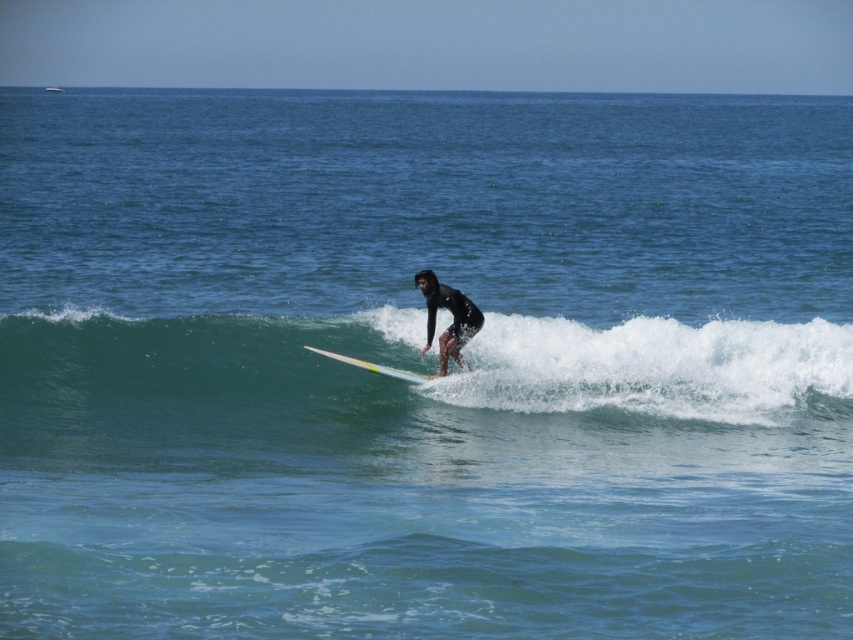
You are a photographer trying to capture the surfer and the surfboard in the same frame. Based on the scene, can you determine if the yellow glossy surfboard at center is positioned in front of or behind the black wetsuit surfer at center?

The yellow glossy surfboard at center is behind the black wetsuit surfer at center, so it will appear behind the surfer in the photograph.

You are a photographer standing on a cliff overlooking the ocean. You want to capture a photo of the point at coordinates [264,401] in the scene. The camera you are using has a minimum focus distance of 20 meters. Will the camera be able to focus on that point?

The point at coordinates [264,401] is 18.04 meters from the camera, which is closer than the minimum focus distance of 20 meters. Therefore, the camera will not be able to focus on that point.

You are a lifeguard observing the ocean scene. You notice the green rubber wave at center and the yellow glossy surfboard at center. Which object is positioned higher in the image?

The green rubber wave at center is above the yellow glossy surfboard at center, so it is positioned higher in the image.